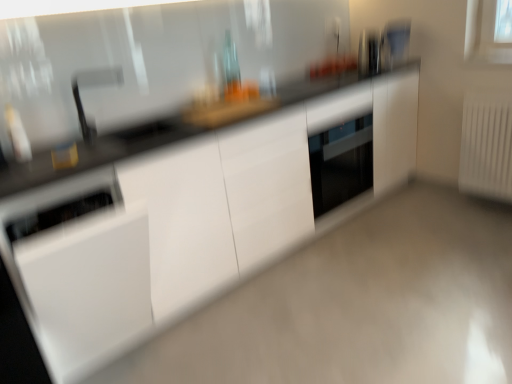
The image size is (512, 384). What do you see at coordinates (93, 86) in the screenshot? I see `satin nickel faucet at upper left` at bounding box center [93, 86].

Where is `satin nickel faucet at upper left`? The height and width of the screenshot is (384, 512). satin nickel faucet at upper left is located at coordinates [93, 86].

This screenshot has width=512, height=384. I want to click on white glossy cabinet at center, so click(x=180, y=215).

The image size is (512, 384). Describe the element at coordinates (180, 215) in the screenshot. I see `white glossy cabinet at center` at that location.

This screenshot has width=512, height=384. Describe the element at coordinates (395, 42) in the screenshot. I see `satin silver toaster at upper right, the first appliance positioned from the back` at that location.

This screenshot has width=512, height=384. Find the location of `white glossy dishwasher at lower left, which appears as the 3th appliance when viewed from the back`. white glossy dishwasher at lower left, which appears as the 3th appliance when viewed from the back is located at coordinates (79, 269).

Measure the distance between white glossy dishwasher at lower left, which appears as the 3th appliance when viewed from the back, and camera.

A distance of 1.33 meters exists between white glossy dishwasher at lower left, which appears as the 3th appliance when viewed from the back, and camera.

Describe the element at coordinates (358, 305) in the screenshot. I see `white glossy cabinet at center` at that location.

Where is `metallic stainless steel toaster at upper right, marked as the 2th appliance in a front-to-back arrangement`? metallic stainless steel toaster at upper right, marked as the 2th appliance in a front-to-back arrangement is located at coordinates (369, 53).

Find the location of `satin nickel faucet at upper left`. satin nickel faucet at upper left is located at coordinates (93, 86).

Consider the image. Between white glossy dishwasher at lower left, marked as the first appliance in a left-to-right arrangement, and white glossy cabinet at center, which one has larger size?

white glossy dishwasher at lower left, marked as the first appliance in a left-to-right arrangement, is bigger.

How different are the orientations of white glossy dishwasher at lower left, the first appliance when ordered from bottom to top, and white glossy cabinet at center in degrees?

179 degrees.

Is white glossy dishwasher at lower left, the first appliance when ordered from bottom to top, not within white glossy cabinet at center?

Yes, white glossy dishwasher at lower left, the first appliance when ordered from bottom to top, is located beyond the bounds of white glossy cabinet at center.

Is white glossy dishwasher at lower left, marked as the first appliance in a left-to-right arrangement, to the left of white glossy cabinet at center from the viewer's perspective?

Correct, you'll find white glossy dishwasher at lower left, marked as the first appliance in a left-to-right arrangement, to the left of white glossy cabinet at center.

Looking at this image, is white glossy cabinet at center in contact with white glossy cabinet at center?

No, white glossy cabinet at center is not next to white glossy cabinet at center.

Is white glossy cabinet at center thinner than white glossy cabinet at center?

Yes.

Considering the positions of point (164, 163) and point (313, 356), is point (164, 163) closer or farther from the camera than point (313, 356)?

Point (164, 163) is positioned farther from the camera compared to point (313, 356).

Which object is positioned more to the left, satin silver toaster at upper right, the first appliance positioned from the back, or white glossy dishwasher at lower left, marked as the first appliance in a left-to-right arrangement?

white glossy dishwasher at lower left, marked as the first appliance in a left-to-right arrangement.

Is satin silver toaster at upper right, positioned as the first appliance in right-to-left order, located outside white glossy dishwasher at lower left, placed as the 1th appliance when sorted from front to back?

That's correct, satin silver toaster at upper right, positioned as the first appliance in right-to-left order, is outside of white glossy dishwasher at lower left, placed as the 1th appliance when sorted from front to back.

From a real-world perspective, who is located lower, satin silver toaster at upper right, the 3th appliance positioned from the left, or white glossy dishwasher at lower left, which is counted as the third appliance, starting from the top?

white glossy dishwasher at lower left, which is counted as the third appliance, starting from the top, from a real-world perspective.

Is point (386, 47) positioned before point (35, 284)?

No, (386, 47) is further to viewer.

Is white glossy cabinet at center aimed at satin nickel faucet at upper left?

No.

Image resolution: width=512 pixels, height=384 pixels. I want to click on faucet to the left of white glossy cabinet at center, so click(x=93, y=86).

Which object is wider, white glossy cabinet at center or satin nickel faucet at upper left?

white glossy cabinet at center.

Would you say white glossy cabinet at center is to the left or to the right of satin nickel faucet at upper left in the picture?

From the image, it's evident that white glossy cabinet at center is to the right of satin nickel faucet at upper left.

Measure the distance between white glossy cabinet at center and satin nickel faucet at upper left.

A distance of 4.85 feet exists between white glossy cabinet at center and satin nickel faucet at upper left.

Would you consider white glossy cabinet at center to be distant from satin nickel faucet at upper left?

Yes, white glossy cabinet at center and satin nickel faucet at upper left are located far from each other.

In terms of size, does white glossy cabinet at center appear bigger or smaller than satin nickel faucet at upper left?

In the image, white glossy cabinet at center appears to be larger than satin nickel faucet at upper left.

Do you think white glossy cabinet at center is within satin nickel faucet at upper left, or outside of it?

white glossy cabinet at center is spatially situated outside satin nickel faucet at upper left.

Is white glossy cabinet at center directly adjacent to white glossy dishwasher at lower left, the first appliance when ordered from bottom to top?

No, white glossy cabinet at center is not making contact with white glossy dishwasher at lower left, the first appliance when ordered from bottom to top.

Considering the relative sizes of white glossy cabinet at center and white glossy dishwasher at lower left, which is counted as the third appliance, starting from the right, in the image provided, is white glossy cabinet at center wider than white glossy dishwasher at lower left, which is counted as the third appliance, starting from the right,?

In fact, white glossy cabinet at center might be narrower than white glossy dishwasher at lower left, which is counted as the third appliance, starting from the right.

Is white glossy cabinet at center aimed at white glossy dishwasher at lower left, which appears as the 3th appliance when viewed from the back?

Yes.

How distant is white glossy cabinet at center from white glossy dishwasher at lower left, which appears as the 3th appliance when viewed from the back?

white glossy cabinet at center and white glossy dishwasher at lower left, which appears as the 3th appliance when viewed from the back, are 11.61 inches apart.

In the scene shown: How different are the orientations of white glossy cabinet at center and white glossy cabinet at center in degrees?

The angular difference between white glossy cabinet at center and white glossy cabinet at center is 179 degrees.

Would you say white glossy cabinet at center is outside white glossy cabinet at center?

Yes.

Considering the positions of point (339, 293) and point (232, 256), is point (339, 293) closer or farther from the camera than point (232, 256)?

Point (339, 293).

This screenshot has height=384, width=512. I want to click on the 1st appliance behind when counting from the white glossy cabinet at center, so click(79, 269).

Find the location of a particular element. The image size is (512, 384). plain located underneath the white glossy cabinet at center (from a real-world perspective) is located at coordinates (358, 305).

Estimate the real-world distances between objects in this image. Which object is further from satin silver toaster at upper right, the first appliance positioned from the back, satin nickel faucet at upper left or white glossy cabinet at center?

Among the two, satin nickel faucet at upper left is located further to satin silver toaster at upper right, the first appliance positioned from the back.

Estimate the real-world distances between objects in this image. Which object is closer to white plastic radiator at right, metallic stainless steel toaster at upper right, acting as the 2th appliance starting from the left, or white glossy dishwasher at lower left, which appears as the 3th appliance when viewed from the back?

Among the two, metallic stainless steel toaster at upper right, acting as the 2th appliance starting from the left, is located nearer to white plastic radiator at right.

From the picture: Considering their positions, is satin nickel faucet at upper left positioned closer to white glossy dishwasher at lower left, the first appliance when ordered from bottom to top, than metallic stainless steel toaster at upper right, marked as the 2th appliance in a front-to-back arrangement?

The object closer to white glossy dishwasher at lower left, the first appliance when ordered from bottom to top, is satin nickel faucet at upper left.

Estimate the real-world distances between objects in this image. Which object is closer to white glossy cabinet at center, white plastic radiator at right or white glossy cabinet at center?

white glossy cabinet at center lies closer to white glossy cabinet at center than the other object.

When comparing their distances from metallic stainless steel toaster at upper right, acting as the 2th appliance starting from the left, does white glossy cabinet at center or white glossy dishwasher at lower left, the first appliance when ordered from bottom to top, seem further?

The object further to metallic stainless steel toaster at upper right, acting as the 2th appliance starting from the left, is white glossy dishwasher at lower left, the first appliance when ordered from bottom to top.

Based on their spatial positions, is white glossy cabinet at center or satin silver toaster at upper right, the 3th appliance positioned from the left, further from white glossy cabinet at center?

satin silver toaster at upper right, the 3th appliance positioned from the left, lies further to white glossy cabinet at center than the other object.

From the image, which object appears to be nearer to satin silver toaster at upper right, which is the 3th appliance in bottom-to-top order, white plastic radiator at right or white glossy cabinet at center?

white plastic radiator at right.

Considering their positions, is white glossy cabinet at center positioned further to metallic stainless steel toaster at upper right, which is the second appliance from back to front, than white glossy dishwasher at lower left, which appears as the 3th appliance when viewed from the back?

The object further to metallic stainless steel toaster at upper right, which is the second appliance from back to front, is white glossy dishwasher at lower left, which appears as the 3th appliance when viewed from the back.

At what (x,y) coordinates should I click in order to perform the action: click on cabinetry between white glossy cabinet at center and metallic stainless steel toaster at upper right, which is the second appliance from back to front, along the z-axis. Please return your answer as a coordinate pair (x, y). This screenshot has height=384, width=512. Looking at the image, I should click on tap(180, 215).

The width and height of the screenshot is (512, 384). Identify the location of faucet between white glossy cabinet at center and satin silver toaster at upper right, positioned as the first appliance in right-to-left order, in the front-back direction. (x=93, y=86).

Find the location of a particular element. radiator located between white glossy cabinet at center and metallic stainless steel toaster at upper right, acting as the 2th appliance starting from the left, in the depth direction is located at coordinates (487, 144).

You are a GUI agent. You are given a task and a screenshot of the screen. Output one action in this format:
    pyautogui.click(x=<x>, y=<y>)
    Task: Click on the faucet positioned between white glossy cabinet at center and metallic stainless steel toaster at upper right, acting as the 2th appliance starting from the left, from near to far
    The width and height of the screenshot is (512, 384).
    Given the screenshot: What is the action you would take?
    pyautogui.click(x=93, y=86)